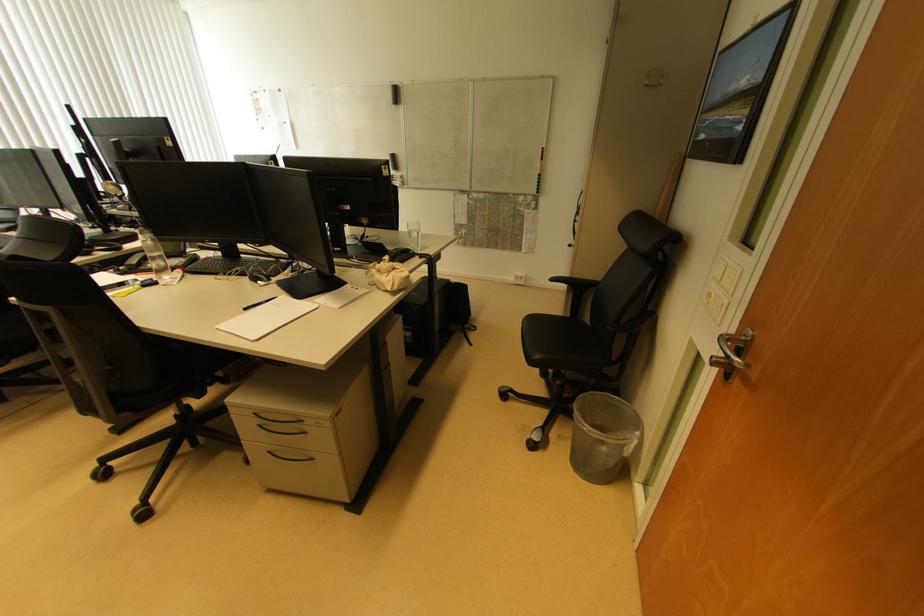
Find where to typ the black keyboard. Please return your answer as a coordinate pair (x, y).

(237, 265)